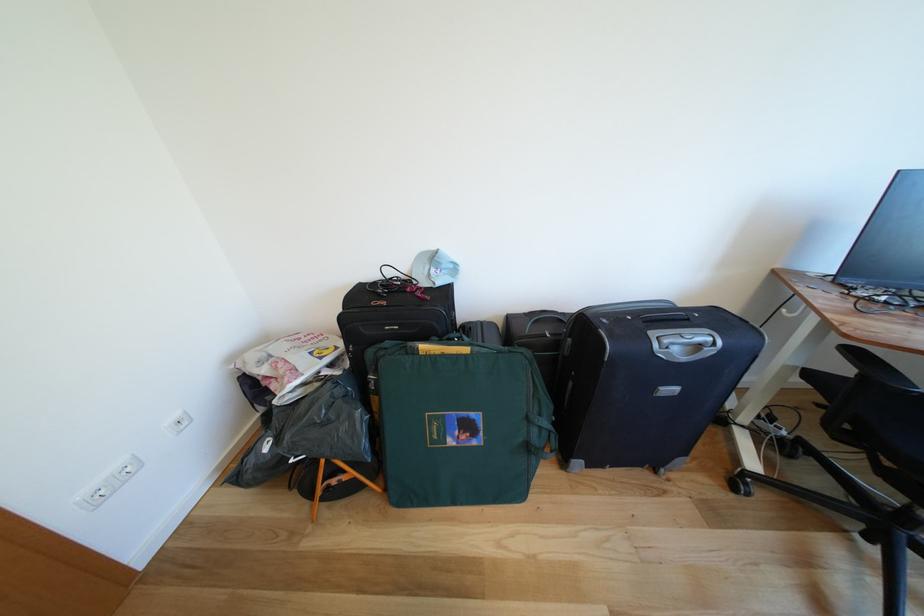
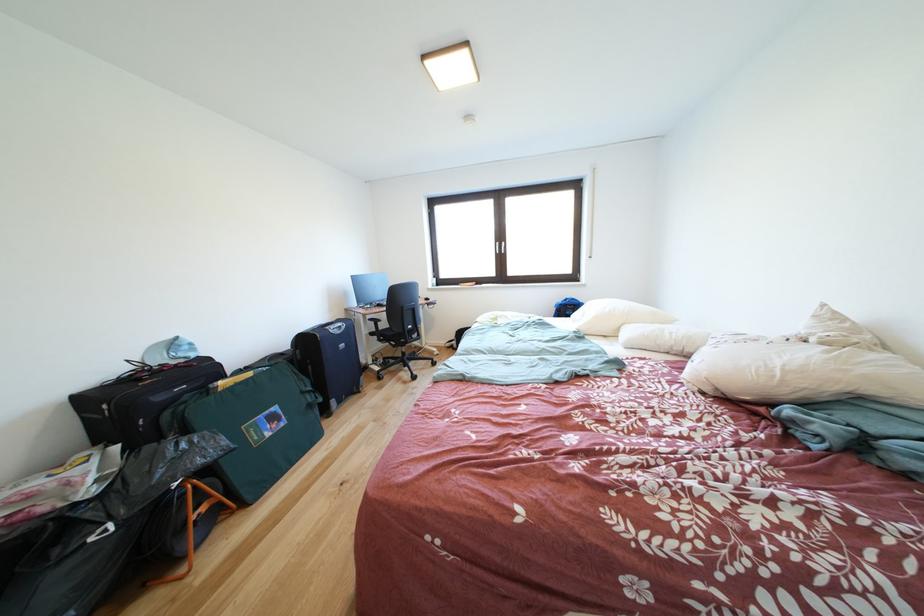
Where in the second image is the point corresponding to pixel 691 363 from the first image?

(347, 337)